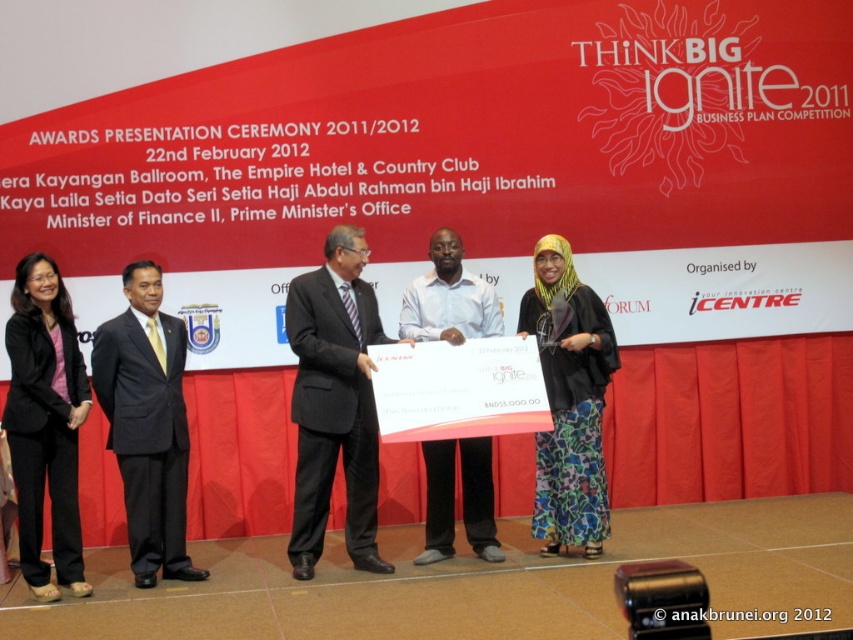
You are a photographer at the event and want to capture a photo of the black fabric pants at lower left and the floral fabric dress at center. Which one is positioned to the left of the other?

The black fabric pants at lower left is positioned on the left side of floral fabric dress at center.

You are standing at the back of the stage and want to take a photo of the point at coordinates point (328, 326). If your camera has a maximum focus range of 15 feet, will you be able to focus on that point?

The distance of point (328, 326) from the camera is 17.05 feet, which exceeds the camera maximum focus range of 15 feet. Therefore, you cannot focus on that point.